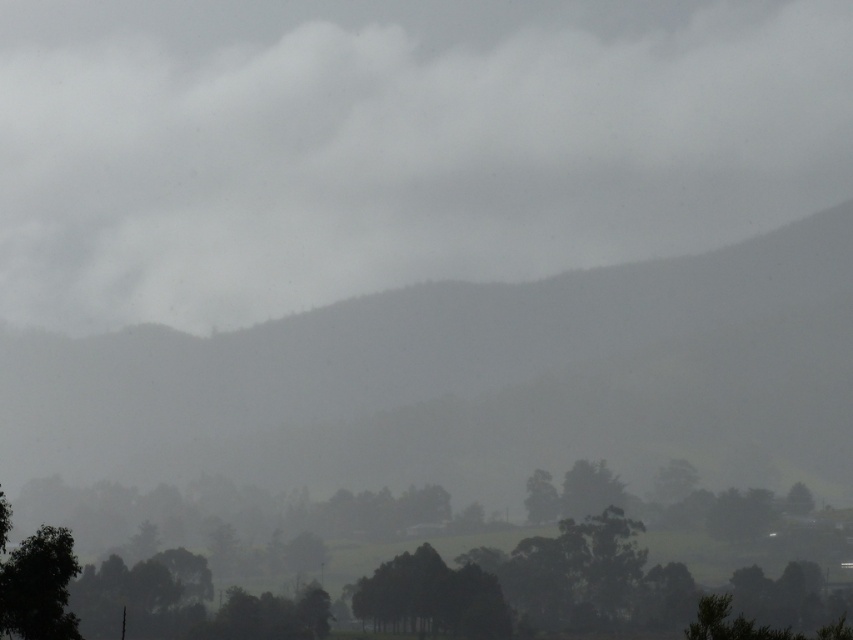
You are a hiker trying to navigate through the misty landscape. You see the green leafy tree at lower left and the green matte tree at center. Which tree would you choose to use as a landmark for navigation, and why?

You should choose the green matte tree at center as a landmark because it is taller than the green leafy tree at lower left, making it more visible and easier to spot through the mist.

You are a hiker planning to set up a tent between the green leafy tree at lower left and the green matte tree at lower right. Considering their heights, which tree would cast a longer shadow during midday when the sun is directly overhead?

The green leafy tree at lower left has a greater height compared to the green matte tree at lower right, so it would cast a longer shadow during midday when the sun is directly overhead.

You are a hiker trying to navigate through the misty landscape. You see the green leafy tree at lower left and the green matte tree at lower right. Which tree would appear larger in your field of view?

The green leafy tree at lower left is closer to the viewer than the green matte tree at lower right, so it would appear larger in your field of view.